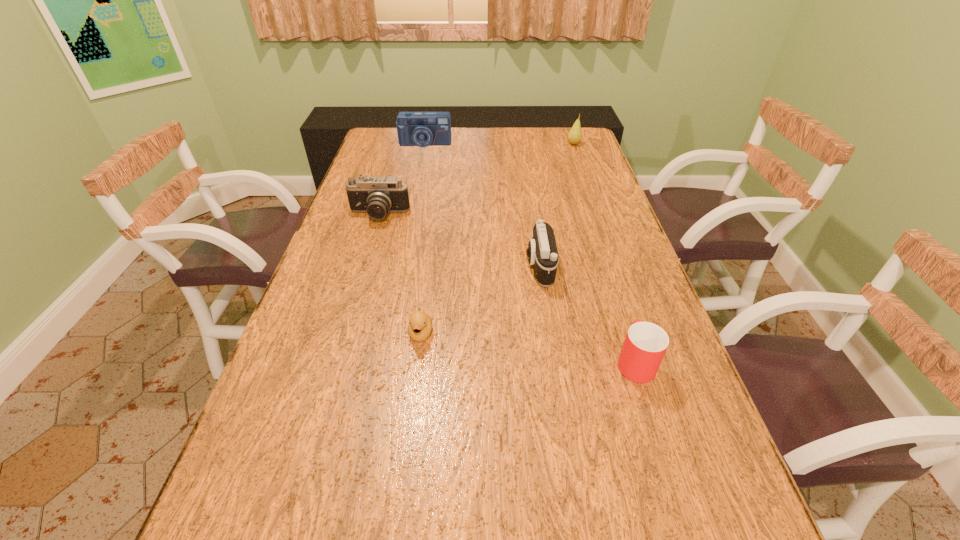
The image size is (960, 540). Identify the location of cup positioned at the right edge. (645, 344).

The height and width of the screenshot is (540, 960). Identify the location of object located at the far left corner. (422, 129).

You are a GUI agent. You are given a task and a screenshot of the screen. Output one action in this format:
    pyautogui.click(x=<x>, y=<y>)
    Task: Click on the object that is at the far right corner
    The image size is (960, 540).
    Given the screenshot: What is the action you would take?
    pyautogui.click(x=574, y=136)

I want to click on free space at the far edge of the desktop, so click(459, 137).

Locate an element on the screen. Image resolution: width=960 pixels, height=540 pixels. vacant space at the left edge is located at coordinates (338, 246).

This screenshot has height=540, width=960. What are the coordinates of `vacant area at the right edge` in the screenshot? It's located at (591, 191).

Identify the location of unoccupied position between the cup and the duckling. This screenshot has width=960, height=540. (528, 347).

The width and height of the screenshot is (960, 540). Find the location of `free space between the cup and the pear`. free space between the cup and the pear is located at coordinates (604, 253).

Locate an element on the screen. This screenshot has width=960, height=540. vacant area between the farthest camera and the pear is located at coordinates (499, 144).

The image size is (960, 540). I want to click on free space between the pear and the farthest camera, so click(499, 144).